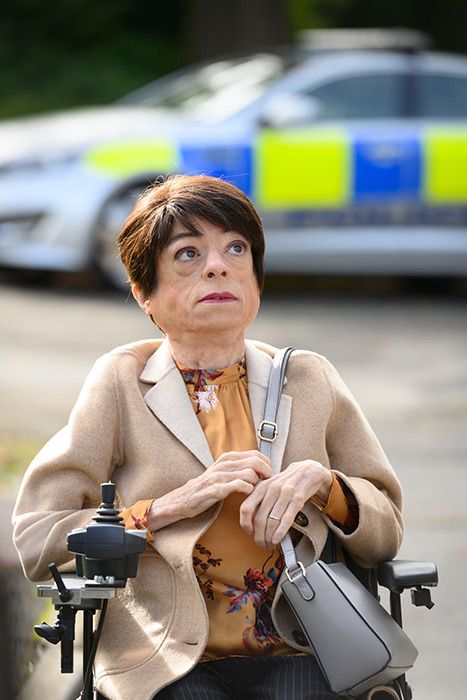
Locate an element on the screen. The image size is (467, 700). box is located at coordinates (113, 530).